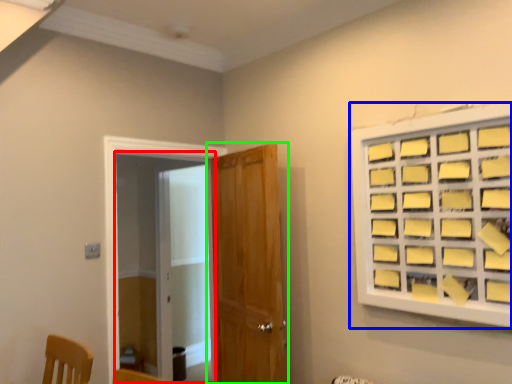
Question: Which object is positioned farthest from screen door (highlighted by a red box)? Select from window (highlighted by a blue box) and door (highlighted by a green box).

Choices:
 (A) window
 (B) door

Answer: (A)